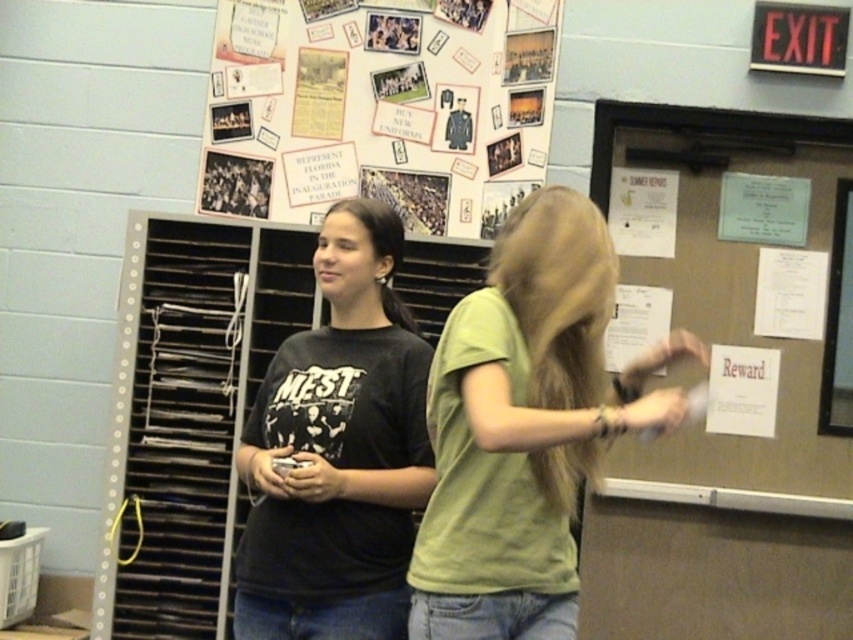
Consider the image. You are a delivery robot that needs to place a package on the matte brown paperboard at right. The package requires a surface at least 3 meters away from the camera to avoid blocking the view. Can you place the package there?

The matte brown paperboard at right is 3.19 meters away from the camera, which meets the requirement of being at least 3 meters away. Therefore, you can safely place the package there without blocking the view.